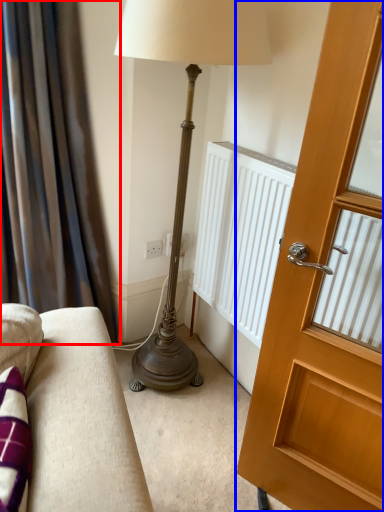
Question: Which object appears farthest to the camera in this image, curtain (highlighted by a red box) or door (highlighted by a blue box)?

Choices:
 (A) curtain
 (B) door

Answer: (A)